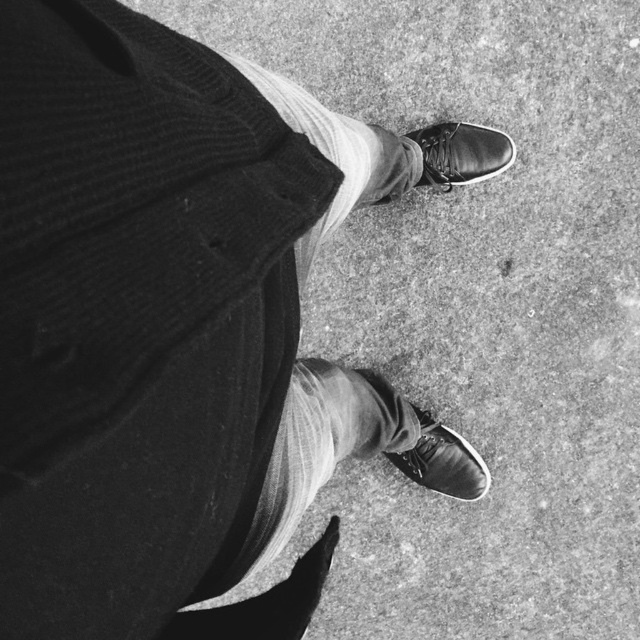
Question: Observing the image, what is the correct spatial positioning of white textured sock at lower center in reference to shiny leather shoe at center?

Choices:
 (A) above
 (B) below

Answer: (B)

Question: Which object is farther from the camera taking this photo?

Choices:
 (A) shiny black shoe at center
 (B) white textured sock at lower center
 (C) shiny leather shoe at center
 (D) white textured sock at center

Answer: (A)

Question: Which point is closer to the camera?

Choices:
 (A) shiny black shoe at center
 (B) shiny leather shoe at center
 (C) white textured sock at center

Answer: (C)

Question: Is white textured sock at center positioned in front of shiny leather shoe at center?

Choices:
 (A) yes
 (B) no

Answer: (A)

Question: Among these points, which one is farthest from the camera?

Choices:
 (A) (506, 145)
 (B) (280, 104)
 (C) (484, 488)

Answer: (C)

Question: Does white textured sock at center have a lesser width compared to shiny leather shoe at center?

Choices:
 (A) yes
 (B) no

Answer: (A)